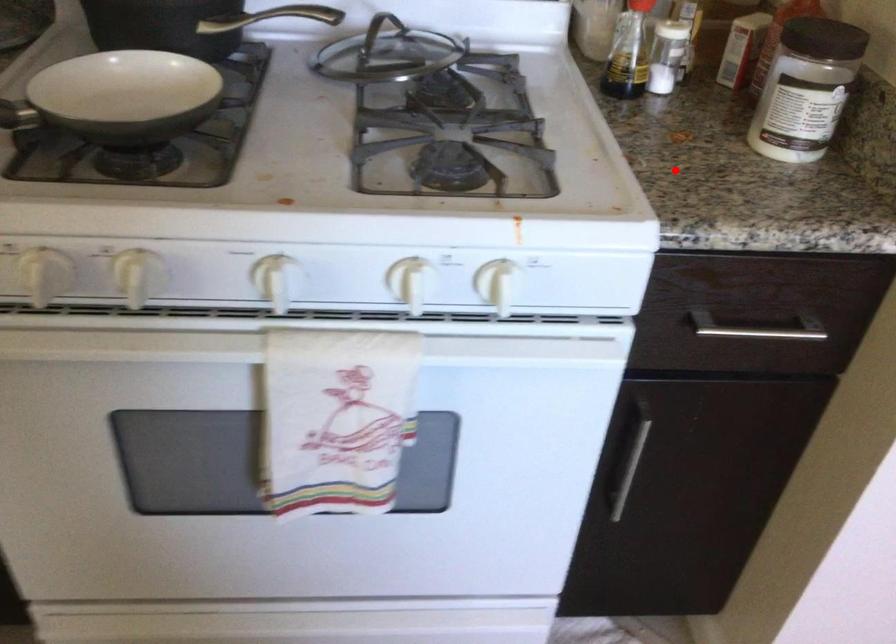
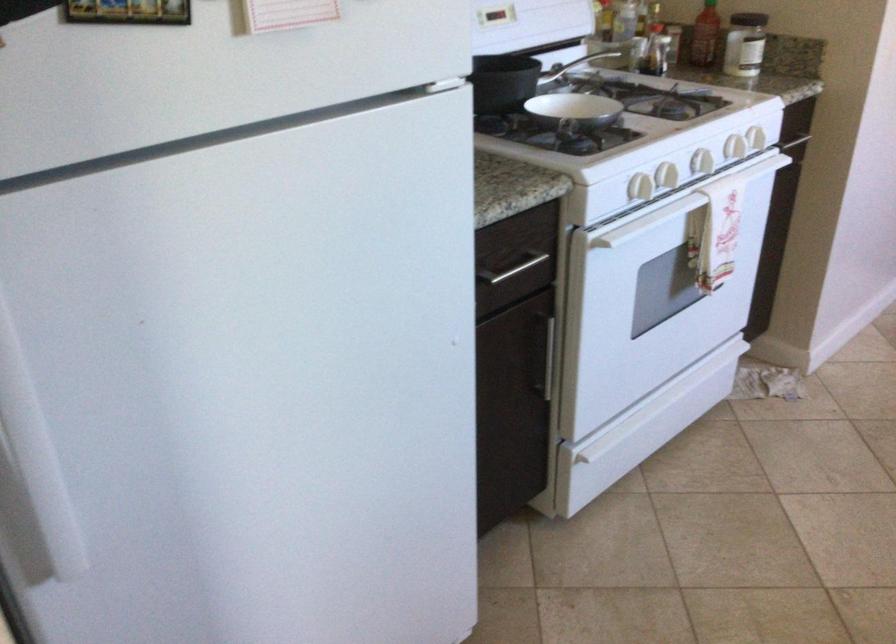
Question: I am providing you with two images of the same scene from different viewpoints. A red point is shown in image1. For the corresponding object point in image2, is it positioned nearer or farther from the camera?

Choices:
 (A) Nearer
 (B) Farther

Answer: (B)